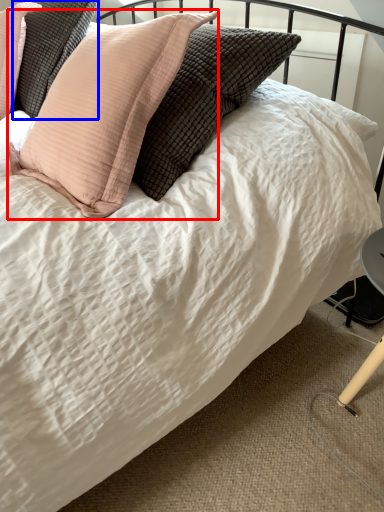
Question: Which object appears farthest to the camera in this image, pillow (highlighted by a red box) or pillow (highlighted by a blue box)?

Choices:
 (A) pillow
 (B) pillow

Answer: (B)